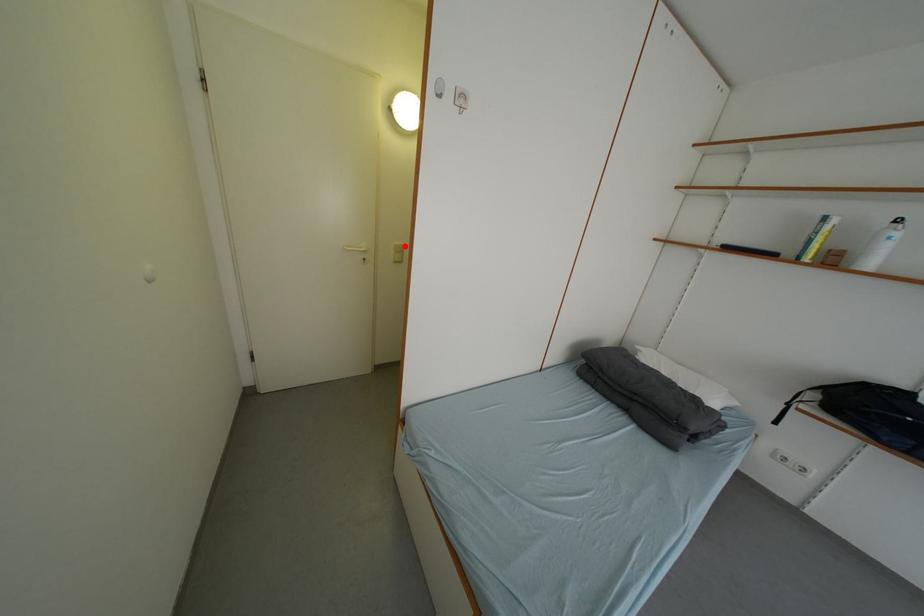
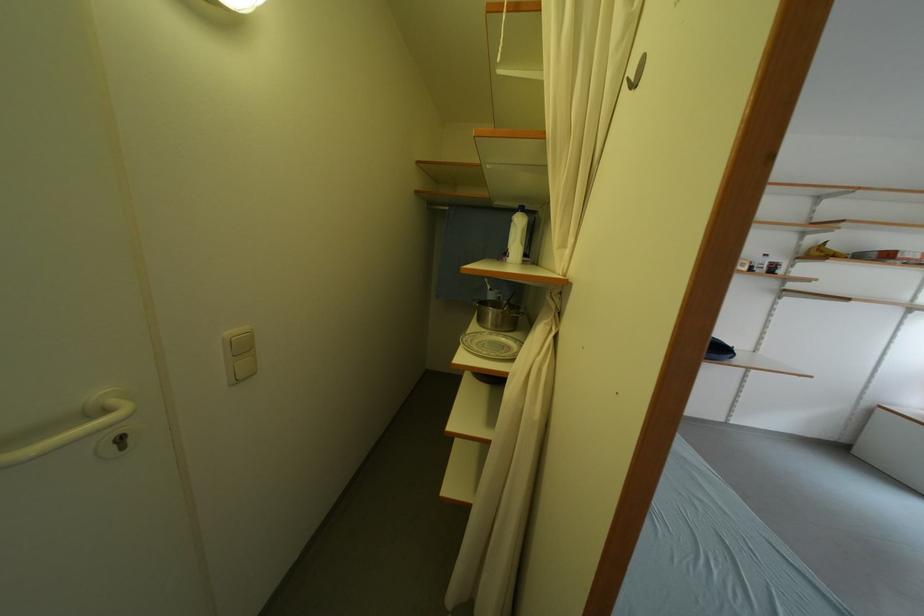
In the second image, find the point that corresponds to the highlighted location in the first image.

(237, 336)